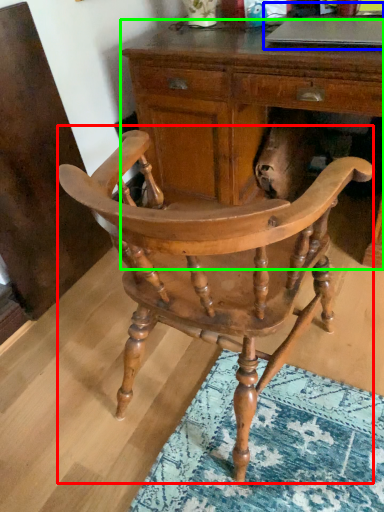
Question: Considering the real-world distances, which object is closest to chair (highlighted by a red box)? computer (highlighted by a blue box) or desk (highlighted by a green box).

Choices:
 (A) computer
 (B) desk

Answer: (B)